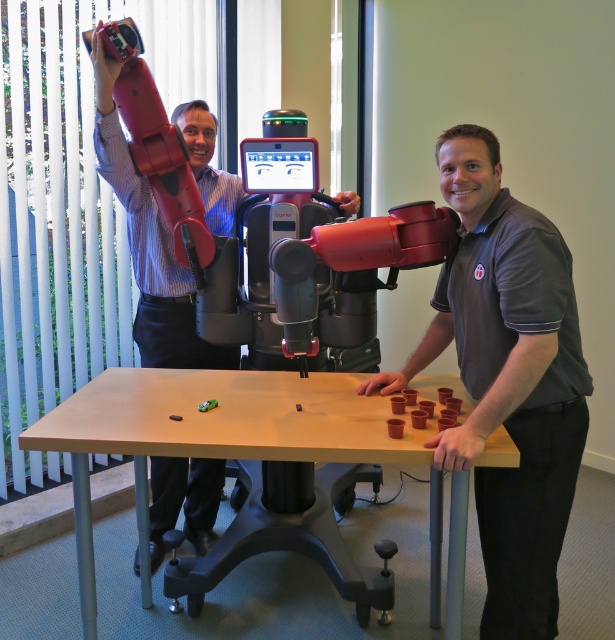
Question: Does gray smooth shirt at right have a greater width compared to brushed metal robot arm at upper left?

Choices:
 (A) no
 (B) yes

Answer: (B)

Question: Considering the real-world distances, which object is farthest from the brushed metal robot arm at upper left?

Choices:
 (A) light brown wood table at center
 (B) gray smooth shirt at right

Answer: (B)

Question: Considering the relative positions of light brown wood table at center and brushed metal robot arm at upper left in the image provided, where is light brown wood table at center located with respect to brushed metal robot arm at upper left?

Choices:
 (A) right
 (B) left

Answer: (A)

Question: Which of the following is the farthest from the observer?

Choices:
 (A) light brown wood table at center
 (B) brushed metal robot arm at upper left

Answer: (B)

Question: Which object is positioned closest to the brushed metal robot arm at upper left?

Choices:
 (A) light brown wood table at center
 (B) gray smooth shirt at right

Answer: (A)

Question: Is gray smooth shirt at right to the right of light brown wood table at center from the viewer's perspective?

Choices:
 (A) yes
 (B) no

Answer: (A)